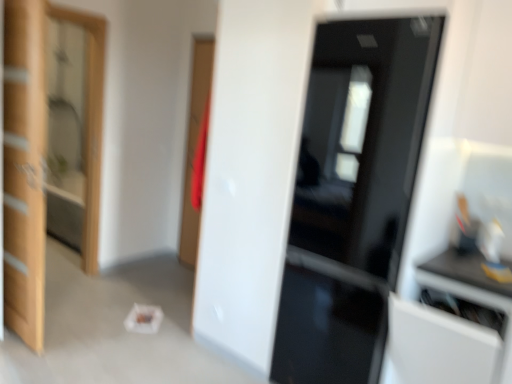
In order to face clear glass screen door at left, should I rotate leftwards or rightwards?

Turn left by 22.994 degrees to look at clear glass screen door at left.

This screenshot has height=384, width=512. Describe the element at coordinates (353, 195) in the screenshot. I see `glossy black door at center, which is the first door from right to left` at that location.

Where is `clear glass screen door at left`? clear glass screen door at left is located at coordinates (91, 125).

From a real-world perspective, is wooden door at left, placed as the first door when sorted from left to right, on glossy black door at center, which is counted as the second door, starting from the left?

Actually, wooden door at left, placed as the first door when sorted from left to right, is physically below glossy black door at center, which is counted as the second door, starting from the left, in the real world.

Which object is more forward, wooden door at left, placed as the first door when sorted from left to right, or glossy black door at center, which is the first door from right to left?

glossy black door at center, which is the first door from right to left, is closer to the camera.

Does wooden door at left, which is the 2th door from right to left, contain glossy black door at center, which is the first door from right to left?

No, glossy black door at center, which is the first door from right to left, is not a part of wooden door at left, which is the 2th door from right to left.

From the image's perspective, is wooden door at left, placed as the first door when sorted from left to right, beneath glossy black door at center, which is the first door from right to left?

Incorrect, from the image's perspective, wooden door at left, placed as the first door when sorted from left to right, is higher than glossy black door at center, which is the first door from right to left.

From the image's perspective, is clear glass screen door at left on top of white glossy cabinet at right?

Yes, from the image's perspective, clear glass screen door at left is over white glossy cabinet at right.

Looking at this image, does clear glass screen door at left lie in front of white glossy cabinet at right?

No, the depth of clear glass screen door at left is greater than that of white glossy cabinet at right.

From the picture: Considering the sizes of objects clear glass screen door at left and white glossy cabinet at right in the image provided, who is taller, clear glass screen door at left or white glossy cabinet at right?

clear glass screen door at left.

Can you see clear glass screen door at left touching white glossy cabinet at right?

No, clear glass screen door at left is not touching white glossy cabinet at right.

Is glossy black door at center, which is the first door from right to left, inside clear glass screen door at left?

No, glossy black door at center, which is the first door from right to left, is located outside of clear glass screen door at left.

At what (x,y) coordinates should I click in order to perform the action: click on screen door above the glossy black door at center, which is the first door from right to left (from the image's perspective). Please return your answer as a coordinate pair (x, y). The width and height of the screenshot is (512, 384). Looking at the image, I should click on (91, 125).

Which is closer, (88, 214) or (311, 286)?

Point (88, 214) appears to be farther away from the viewer than point (311, 286).

From the image's perspective, does clear glass screen door at left appear higher than glossy black door at center, which is counted as the second door, starting from the left?

Yes.

Considering the relative sizes of white glossy cabinet at right and clear glass screen door at left in the image provided, is white glossy cabinet at right thinner than clear glass screen door at left?

No, white glossy cabinet at right is not thinner than clear glass screen door at left.

Considering the relative sizes of white glossy cabinet at right and clear glass screen door at left in the image provided, is white glossy cabinet at right smaller than clear glass screen door at left?

Incorrect, white glossy cabinet at right is not smaller in size than clear glass screen door at left.

Locate an element on the screen. screen door above the white glossy cabinet at right (from the image's perspective) is located at coordinates (x=91, y=125).

Is point (97, 189) in front of point (25, 80)?

No, it is behind (25, 80).

Which object is wider, clear glass screen door at left or wooden door at left, which is the 2th door from right to left?

clear glass screen door at left.

Is clear glass screen door at left bigger or smaller than wooden door at left, placed as the first door when sorted from left to right?

Clearly, clear glass screen door at left is smaller in size than wooden door at left, placed as the first door when sorted from left to right.

Which is behind, point (30, 103) or point (390, 303)?

The point (30, 103) is farther.

Which object is thinner, wooden door at left, which is the 2th door from right to left, or white glossy cabinet at right?

wooden door at left, which is the 2th door from right to left.

Is wooden door at left, placed as the first door when sorted from left to right, positioned with its back to white glossy cabinet at right?

No, wooden door at left, placed as the first door when sorted from left to right, is not facing away from white glossy cabinet at right.

Is white glossy cabinet at right far away from wooden door at left, placed as the first door when sorted from left to right?

Absolutely, white glossy cabinet at right is distant from wooden door at left, placed as the first door when sorted from left to right.

Which object is wider, white glossy cabinet at right or wooden door at left, which is the 2th door from right to left?

white glossy cabinet at right is wider.

In the scene shown: Can you confirm if white glossy cabinet at right is bigger than wooden door at left, placed as the first door when sorted from left to right?

Correct, white glossy cabinet at right is larger in size than wooden door at left, placed as the first door when sorted from left to right.

Find the location of `door below the glossy black door at center, which is the first door from right to left (from a real-world perspective)`. door below the glossy black door at center, which is the first door from right to left (from a real-world perspective) is located at coordinates (24, 168).

The width and height of the screenshot is (512, 384). In order to click on screen door above the white glossy cabinet at right (from the image's perspective) in this screenshot , I will do `click(91, 125)`.

Looking at the image, which one is located further to clear glass screen door at left, wooden door at left, which is the 2th door from right to left, or white glossy cabinet at right?

white glossy cabinet at right is positioned further to the anchor clear glass screen door at left.

From the image, which object appears to be nearer to wooden door at left, placed as the first door when sorted from left to right, clear glass screen door at left or glossy black door at center, which is counted as the second door, starting from the left?

clear glass screen door at left.

Looking at the image, which one is located closer to wooden door at left, which is the 2th door from right to left, white glossy cabinet at right or glossy black door at center, which is the first door from right to left?

Based on the image, glossy black door at center, which is the first door from right to left, appears to be nearer to wooden door at left, which is the 2th door from right to left.

Considering their positions, is white glossy cabinet at right positioned further to glossy black door at center, which is the first door from right to left, than clear glass screen door at left?

clear glass screen door at left.

When comparing their distances from glossy black door at center, which is counted as the second door, starting from the left, does clear glass screen door at left or white glossy cabinet at right seem closer?

white glossy cabinet at right.

Considering their positions, is white glossy cabinet at right positioned further to clear glass screen door at left than wooden door at left, which is the 2th door from right to left?

white glossy cabinet at right lies further to clear glass screen door at left than the other object.

Based on their spatial positions, is glossy black door at center, which is the first door from right to left, or white glossy cabinet at right closer to clear glass screen door at left?

glossy black door at center, which is the first door from right to left.

Consider the image. Based on their spatial positions, is clear glass screen door at left or glossy black door at center, which is the first door from right to left, further from white glossy cabinet at right?

clear glass screen door at left is positioned further to the anchor white glossy cabinet at right.

In order to click on door situated between wooden door at left, placed as the first door when sorted from left to right, and white glossy cabinet at right from left to right in this screenshot , I will do `click(353, 195)`.

The image size is (512, 384). I want to click on door situated between clear glass screen door at left and glossy black door at center, which is the first door from right to left, from left to right, so click(x=24, y=168).